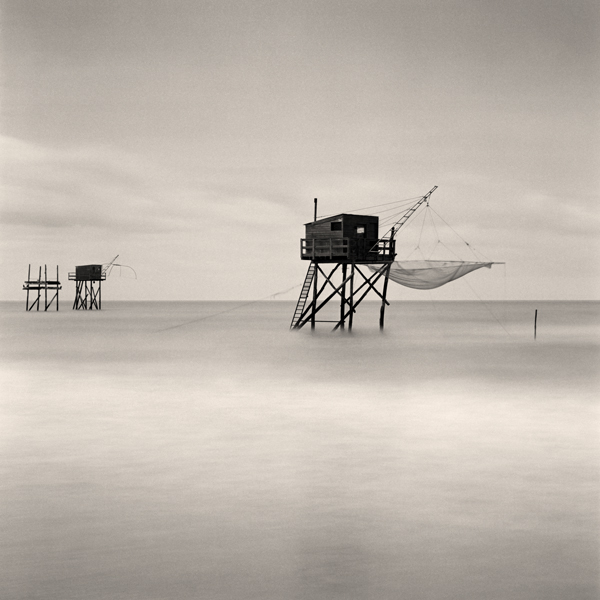
Image resolution: width=600 pixels, height=600 pixels. Find the location of `ladder`. ladder is located at coordinates tap(299, 307).